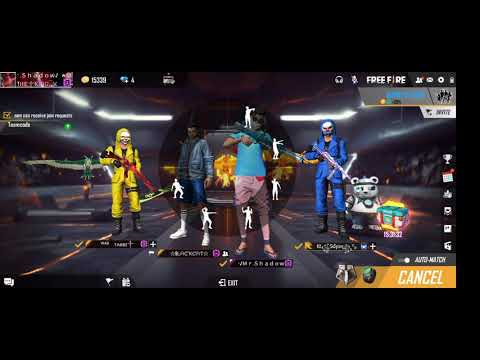
Image resolution: width=480 pixels, height=360 pixels. Identify the location of tv. (302, 83).